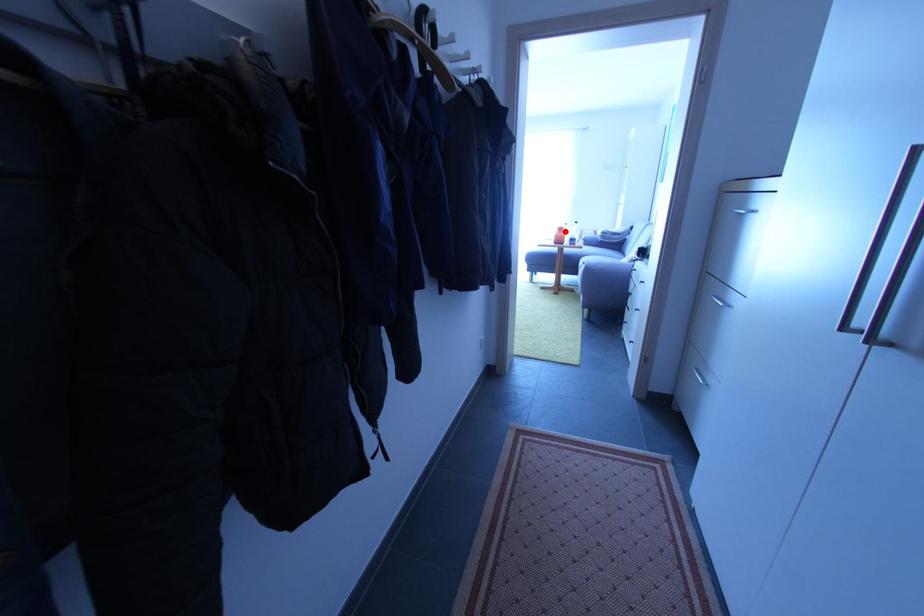
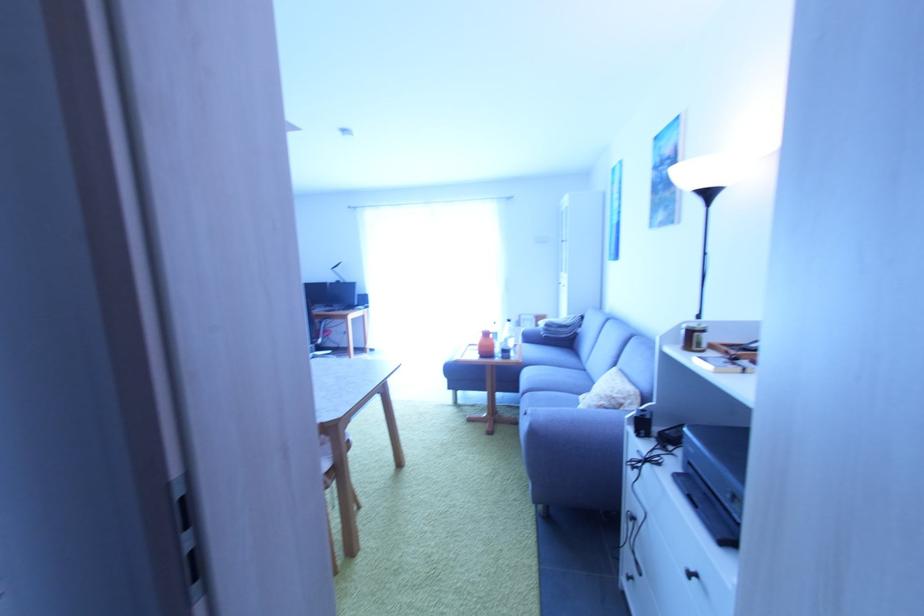
Question: I am providing you with two images of the same scene from different viewpoints. A red point is marked on the first image. Can you still see the location of the red point in image 2?

Choices:
 (A) Yes
 (B) No

Answer: (A)